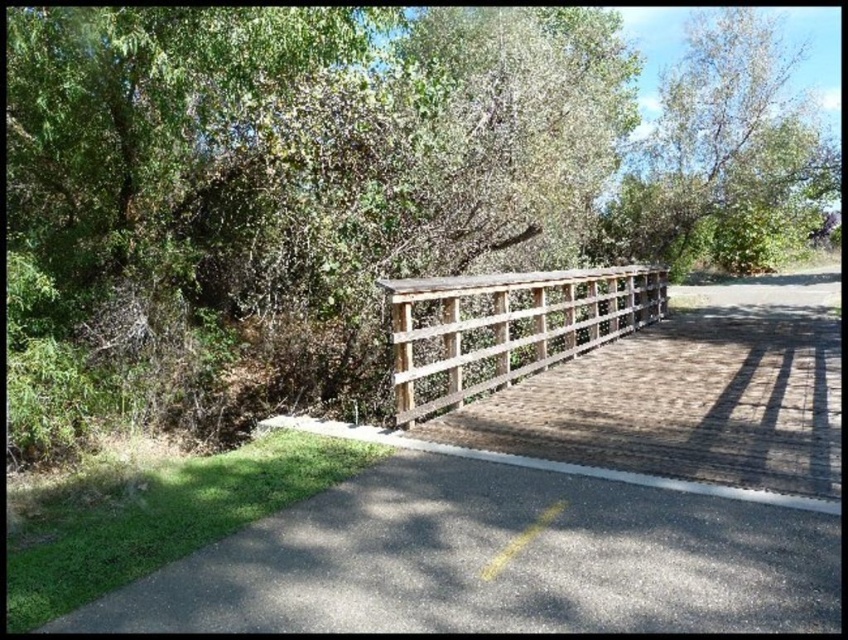
Is point (250, 240) more distant than point (777, 129)?

No, it is in front of (777, 129).

This screenshot has height=640, width=848. I want to click on green leafy tree at center, so click(296, 192).

Who is taller, green leafy tree at upper right or weathered wood fence at center?

green leafy tree at upper right is taller.

Between green leafy tree at upper right and weathered wood fence at center, which one has less height?

Standing shorter between the two is weathered wood fence at center.

At what (x,y) coordinates should I click in order to perform the action: click on green leafy tree at upper right. Please return your answer as a coordinate pair (x, y). This screenshot has width=848, height=640. Looking at the image, I should click on (722, 132).

Who is higher up, green leafy tree at center or weathered wood fence at center?

Answer: Positioned higher is green leafy tree at center.

Is point (462, 168) positioned after point (593, 332)?

No, it is in front of (593, 332).

At what (x,y) coordinates should I click in order to perform the action: click on green leafy tree at center. Please return your answer as a coordinate pair (x, y). Image resolution: width=848 pixels, height=640 pixels. Looking at the image, I should click on (296, 192).